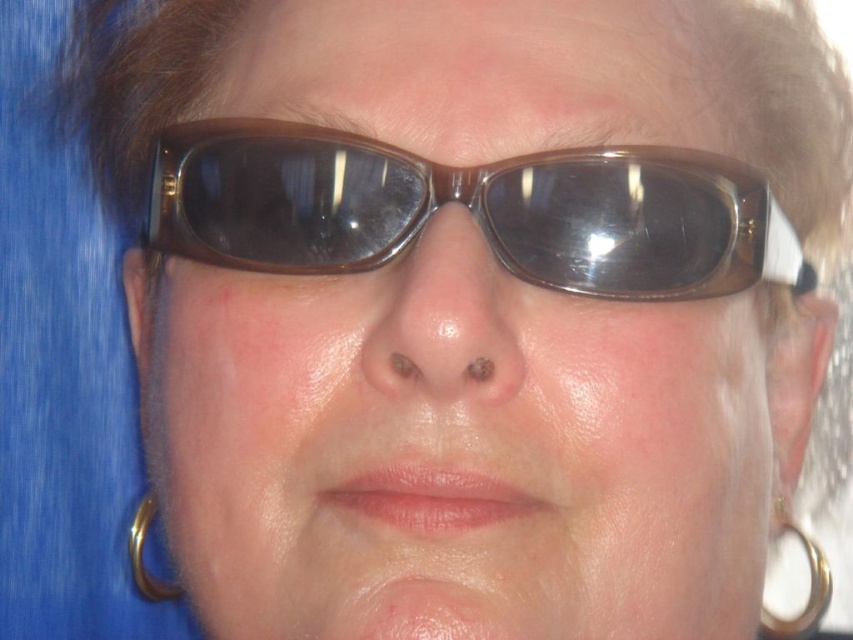
Question: Does pink matte lips at center appear on the right side of gold metallic hoop at lower right?

Choices:
 (A) yes
 (B) no

Answer: (B)

Question: Considering the relative positions of matte brown sunglasses at center and gold metallic hoop at lower right in the image provided, where is matte brown sunglasses at center located with respect to gold metallic hoop at lower right?

Choices:
 (A) below
 (B) above

Answer: (B)

Question: Can you confirm if pink matte lips at center is thinner than gold metallic hoop at lower right?

Choices:
 (A) yes
 (B) no

Answer: (B)

Question: Among these objects, which one is farthest from the camera?

Choices:
 (A) pink matte lips at center
 (B) gold metallic hoop at lower right

Answer: (B)

Question: Based on their relative distances, which object is farther from the gold metallic hoop at lower right?

Choices:
 (A) brown translucent glasses at center
 (B) pink matte lips at center

Answer: (B)

Question: Which of the following is the farthest from the observer?

Choices:
 (A) brown translucent glasses at center
 (B) matte plastic nose at center

Answer: (A)